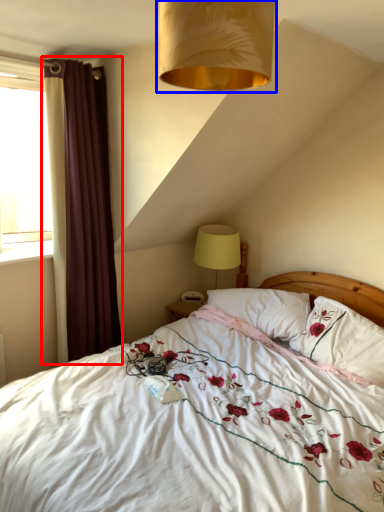
Question: Which object is closer to the camera taking this photo, curtain (highlighted by a red box) or lamp (highlighted by a blue box)?

Choices:
 (A) curtain
 (B) lamp

Answer: (B)